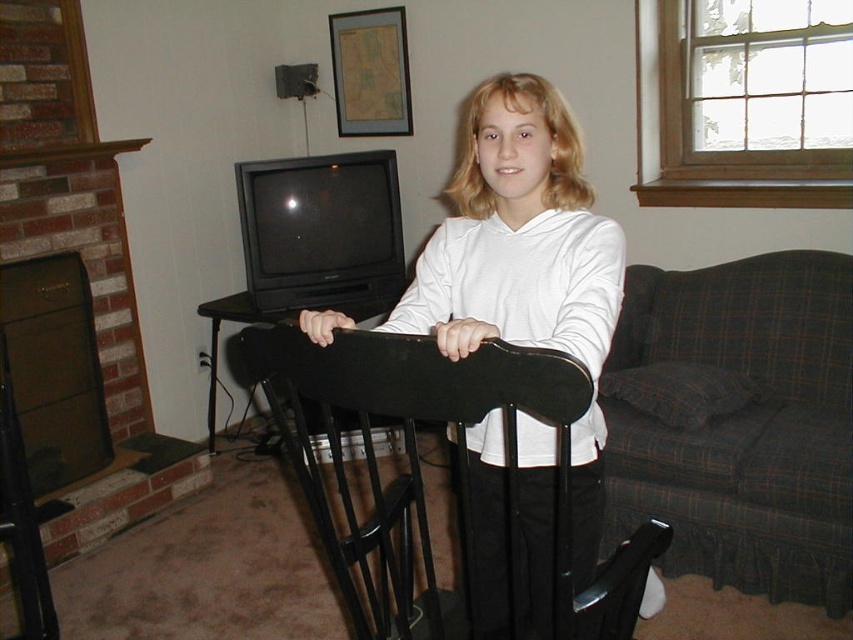
Is white matte hoodie at center taller than black wood rocking chair at center?

Correct, white matte hoodie at center is much taller as black wood rocking chair at center.

Looking at this image, who is taller, white matte hoodie at center or black wood rocking chair at center?

white matte hoodie at center

Which is in front, point (596, 376) or point (427, 572)?

Point (596, 376) is more forward.

This screenshot has height=640, width=853. Find the location of `white matte hoodie at center`. white matte hoodie at center is located at coordinates (517, 236).